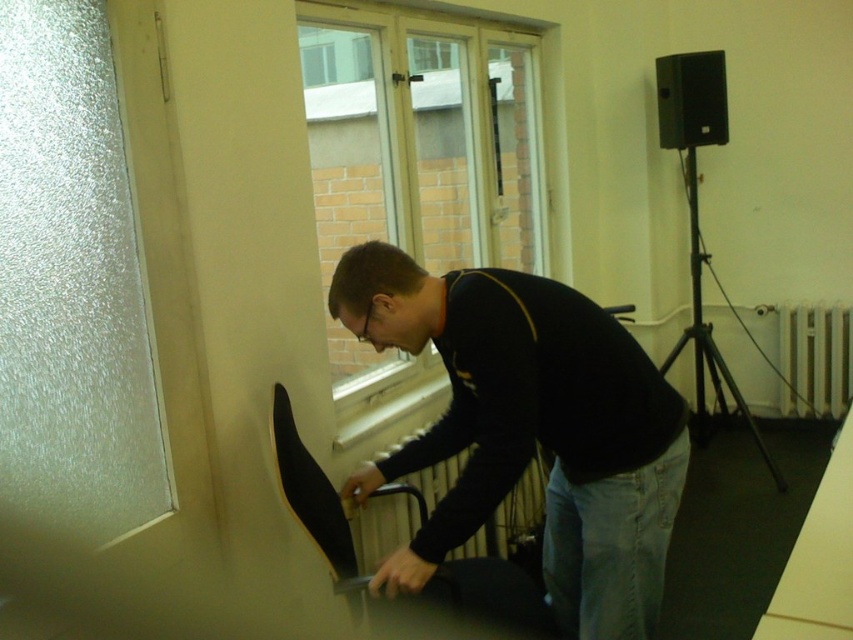
Between black matte sweater at center and white metallic radiator at lower right, which one has more height?

With more height is black matte sweater at center.

Locate an element on the screen. The width and height of the screenshot is (853, 640). black matte sweater at center is located at coordinates (529, 429).

Is metallic radiator at center wider than black matte tripod at right?

Indeed, metallic radiator at center has a greater width compared to black matte tripod at right.

Who is more distant from viewer, (402, 492) or (698, 317)?

Point (698, 317)

Image resolution: width=853 pixels, height=640 pixels. What are the coordinates of `metallic radiator at center` in the screenshot? It's located at 404,504.

Is clear glass window at upper center shorter than metallic radiator at center?

Incorrect, clear glass window at upper center's height does not fall short of metallic radiator at center's.

Identify the location of clear glass window at upper center. The image size is (853, 640). (422, 136).

The image size is (853, 640). Describe the element at coordinates (422, 136) in the screenshot. I see `clear glass window at upper center` at that location.

Identify the location of clear glass window at upper center. (422, 136).